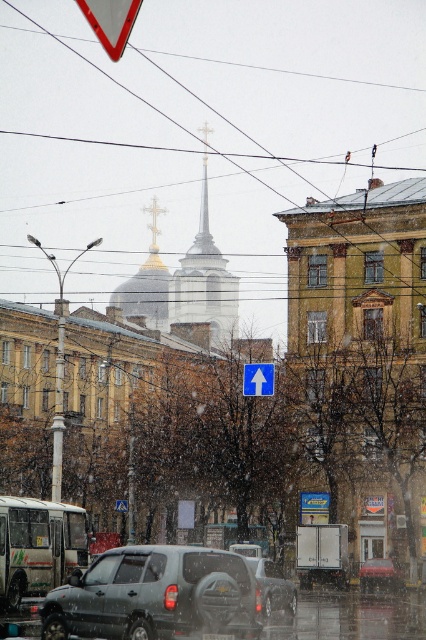
Question: Which point is farther to the camera?

Choices:
 (A) smooth white spire at center
 (B) blue plastic arrow at center

Answer: (A)

Question: Estimate the real-world distances between objects in this image. Which object is farther from the blue plastic arrow at center?

Choices:
 (A) smooth white spire at center
 (B) metallic gray suv at center

Answer: (A)

Question: From the image, what is the correct spatial relationship of metallic gray suv at center in relation to metallic silver suv at center?

Choices:
 (A) above
 (B) below

Answer: (A)

Question: Does white matte bus at center appear over metallic triangular sign at center?

Choices:
 (A) yes
 (B) no

Answer: (A)

Question: Which object is farther from the camera taking this photo?

Choices:
 (A) metallic gray suv at center
 (B) metallic silver suv at center
 (C) smooth white spire at center
 (D) blue plastic arrow at center

Answer: (C)

Question: Where is metallic silver suv at center located in relation to blue plastic arrow at center in the image?

Choices:
 (A) left
 (B) right

Answer: (B)